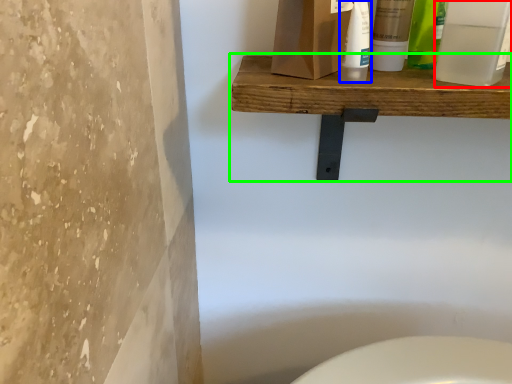
Question: Estimate the real-world distances between objects in this image. Which object is closer to mouthwash (highlighted by a red box), cleaning product (highlighted by a blue box) or shelf (highlighted by a green box)?

Choices:
 (A) cleaning product
 (B) shelf

Answer: (A)